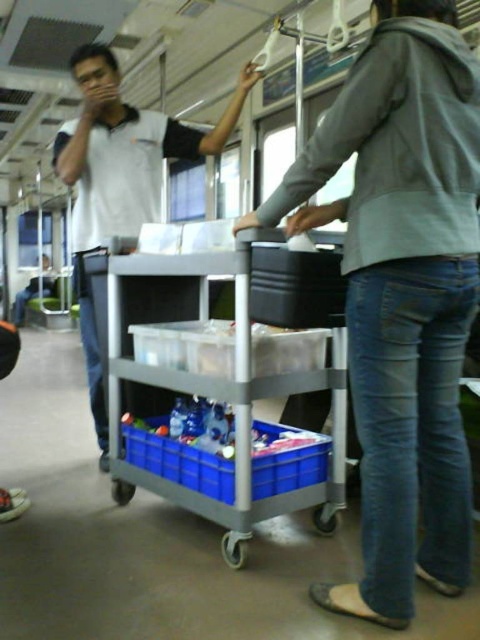
Find the location of a particular element. The width and height of the screenshot is (480, 640). gray plastic trolley at center is located at coordinates (222, 369).

Can you confirm if gray plastic trolley at center is shorter than white matte shirt at upper left?

Yes, gray plastic trolley at center is shorter than white matte shirt at upper left.

The image size is (480, 640). What do you see at coordinates (222, 369) in the screenshot?
I see `gray plastic trolley at center` at bounding box center [222, 369].

I want to click on gray plastic trolley at center, so click(222, 369).